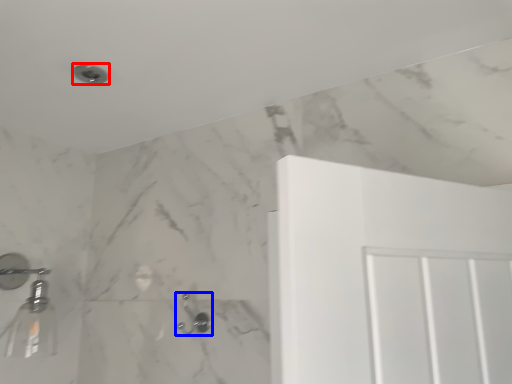
Question: Which of the following is the closest to the observer, shower (highlighted by a red box) or shower (highlighted by a blue box)?

Choices:
 (A) shower
 (B) shower

Answer: (A)